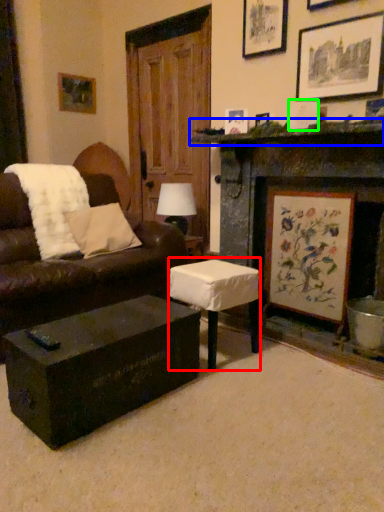
Question: Which object is the closest to the table (highlighted by a red box)? Choose among these: mantle (highlighted by a blue box) or picture frame (highlighted by a green box).

Choices:
 (A) mantle
 (B) picture frame

Answer: (A)